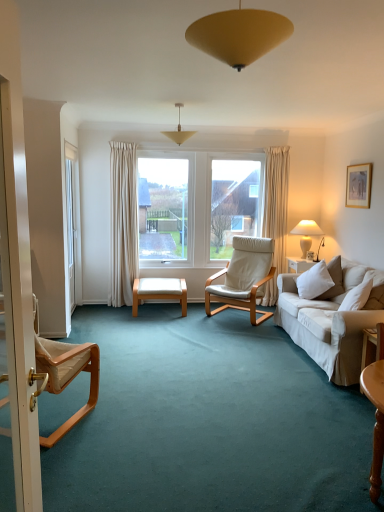
The width and height of the screenshot is (384, 512). What are the coordinates of `free region under light brown wood chair at left, the 2th chair in the right-to-left sequence (from a real-world perspective)` in the screenshot? It's located at (56, 409).